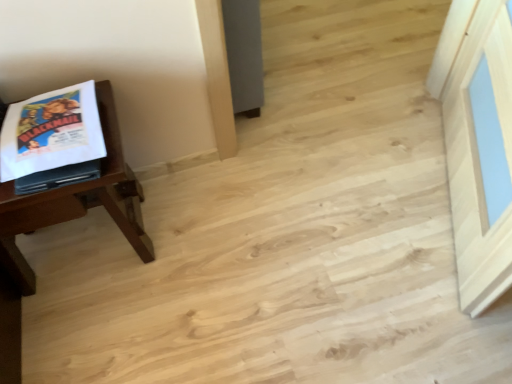
Question: Is wooden table at left in front of white paper comic book at left?

Choices:
 (A) yes
 (B) no

Answer: (A)

Question: Is wooden table at left to the right of white paper comic book at left from the viewer's perspective?

Choices:
 (A) no
 (B) yes

Answer: (A)

Question: Is wooden table at left located outside white paper comic book at left?

Choices:
 (A) yes
 (B) no

Answer: (A)

Question: Can you confirm if wooden table at left is smaller than white paper comic book at left?

Choices:
 (A) yes
 (B) no

Answer: (B)

Question: Does wooden table at left turn towards white paper comic book at left?

Choices:
 (A) yes
 (B) no

Answer: (B)

Question: From the image's perspective, is wooden table at left located beneath white paper comic book at left?

Choices:
 (A) no
 (B) yes

Answer: (B)

Question: Does white paper comic book at left come in front of wooden table at left?

Choices:
 (A) yes
 (B) no

Answer: (B)

Question: Would you say white paper comic book at left is outside wooden table at left?

Choices:
 (A) yes
 (B) no

Answer: (B)

Question: From a real-world perspective, is white paper comic book at left positioned over wooden table at left based on gravity?

Choices:
 (A) yes
 (B) no

Answer: (A)

Question: Can you confirm if white paper comic book at left is positioned to the left of wooden table at left?

Choices:
 (A) no
 (B) yes

Answer: (A)

Question: Is white paper comic book at left not close to wooden table at left?

Choices:
 (A) no
 (B) yes

Answer: (A)

Question: Can you confirm if white paper comic book at left is positioned to the right of wooden table at left?

Choices:
 (A) no
 (B) yes

Answer: (B)

Question: Is wooden table at left wider or thinner than white paper comic book at left?

Choices:
 (A) wide
 (B) thin

Answer: (A)